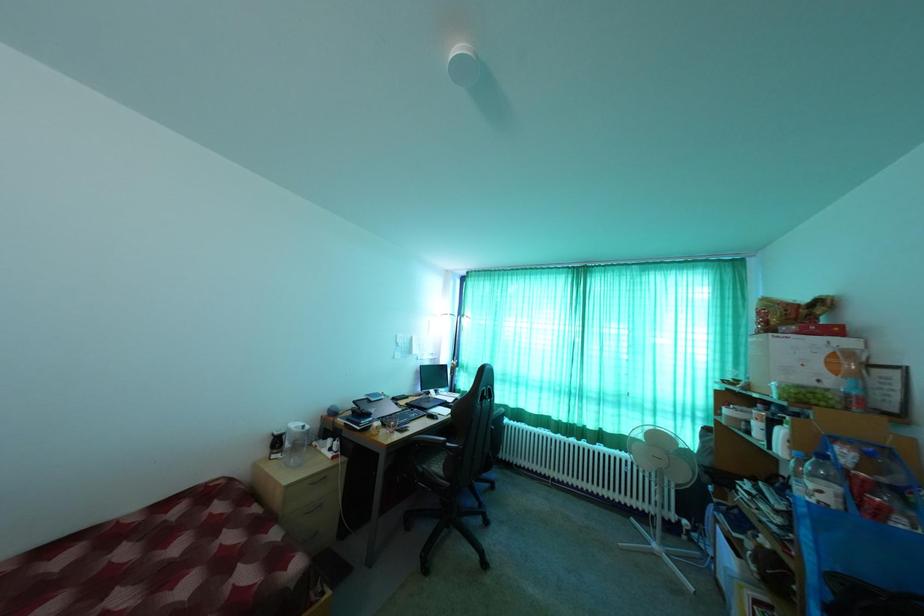
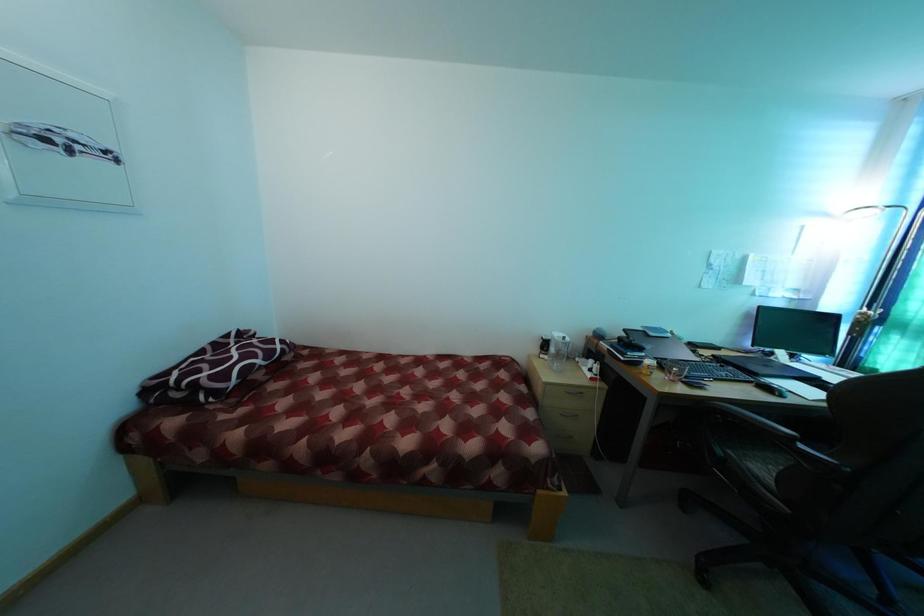
Question: The camera is either moving clockwise (left) or counter-clockwise (right) around the object. The first image is from the beginning of the video and the second image is from the end. Is the camera moving left or right when shooting the video?

Choices:
 (A) Left
 (B) Right

Answer: (B)